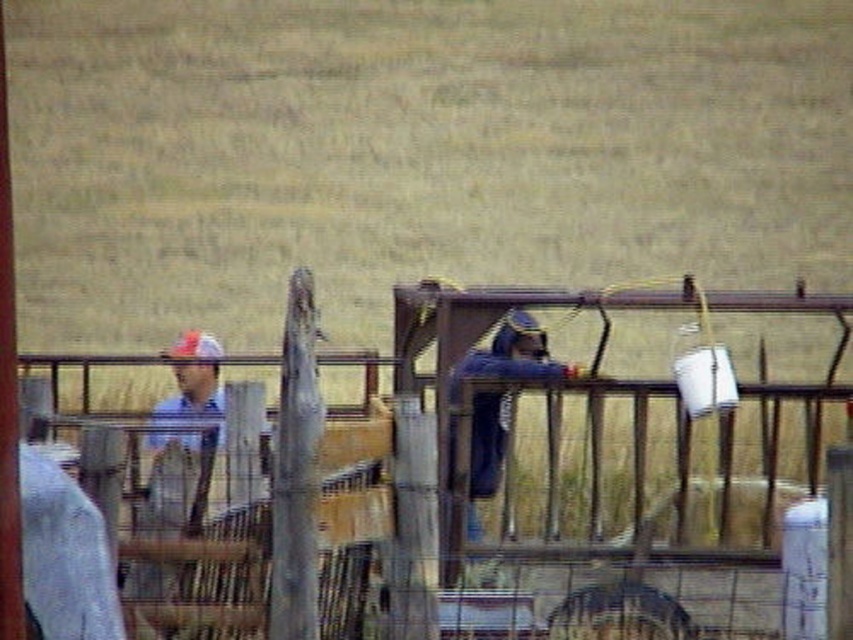
Question: Observing the image, what is the correct spatial positioning of blue denim shirt at left in reference to blue denim jacket at center?

Choices:
 (A) below
 (B) above

Answer: (B)

Question: Based on their relative distances, which object is farther from the blue denim jacket at center?

Choices:
 (A) brown wooden fence at center
 (B) blue denim shirt at left

Answer: (B)

Question: Does blue denim shirt at left have a greater width compared to blue denim jacket at center?

Choices:
 (A) no
 (B) yes

Answer: (B)

Question: From the image, what is the correct spatial relationship of brown wooden fence at center in relation to blue denim jacket at center?

Choices:
 (A) left
 (B) right

Answer: (B)

Question: Among these objects, which one is farthest from the camera?

Choices:
 (A) brown wooden fence at center
 (B) blue denim jacket at center

Answer: (B)

Question: Which point is farther to the camera?

Choices:
 (A) blue denim jacket at center
 (B) blue denim shirt at left

Answer: (A)